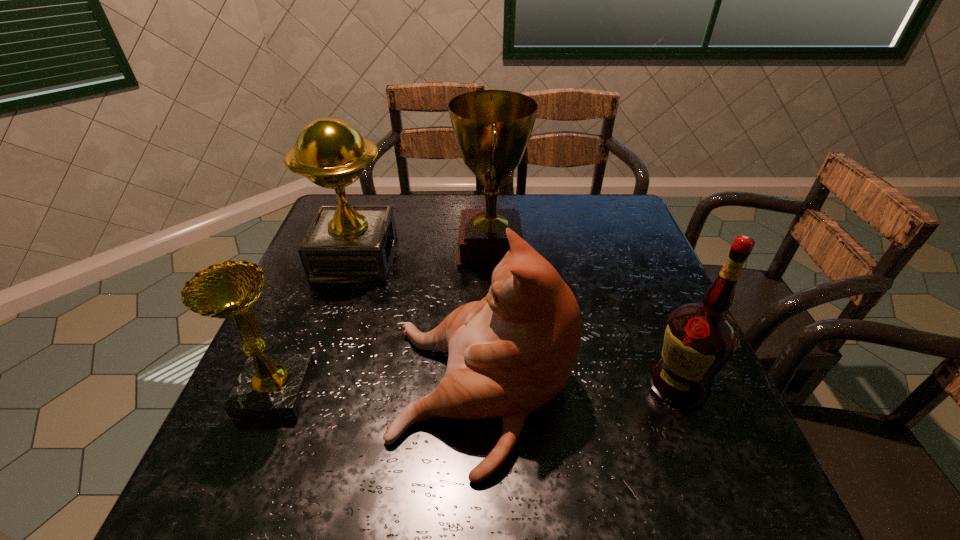
The image size is (960, 540). What are the coordinates of `award that is the second closest one to the rightmost object` in the screenshot? It's located at (345, 243).